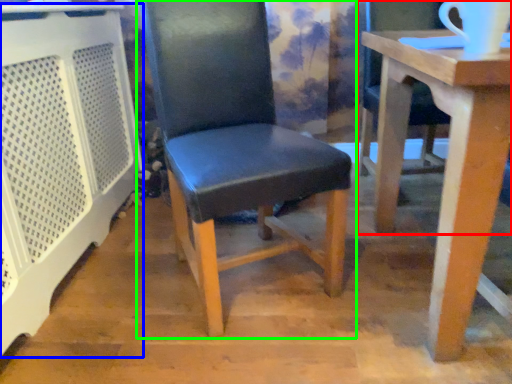
Question: Considering the real-world distances, which object is closest to chair (highlighted by a red box)? cage (highlighted by a blue box) or chair (highlighted by a green box).

Choices:
 (A) cage
 (B) chair

Answer: (B)